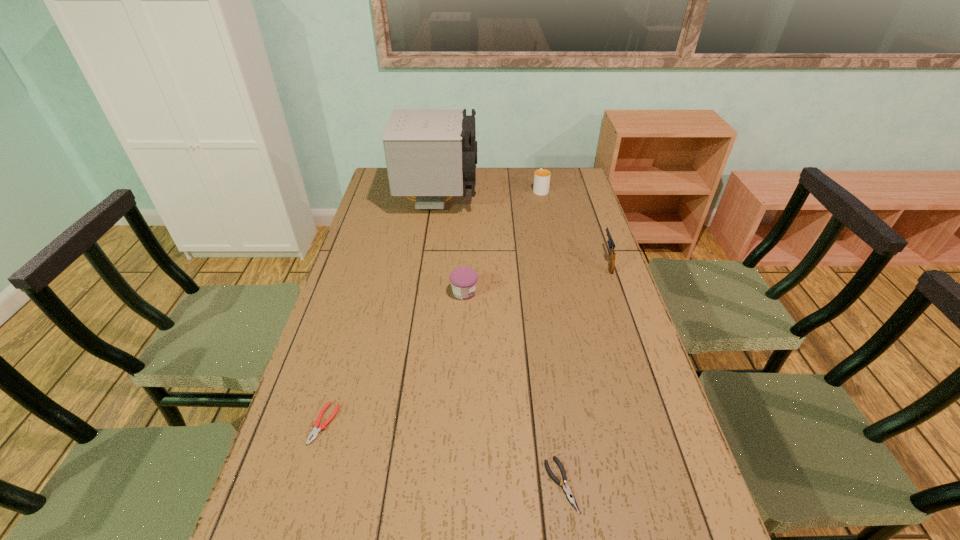
At what (x,y) coordinates should I click in order to perform the action: click on vacant area located 0.050m on the left of the tallest object. Please return your answer as a coordinate pair (x, y). Looking at the image, I should click on (386, 201).

Where is `vacant point located along the barrel of the gun`? vacant point located along the barrel of the gun is located at coordinates (598, 233).

The height and width of the screenshot is (540, 960). I want to click on vacant point located along the barrel of the gun, so click(x=585, y=194).

You are a GUI agent. You are given a task and a screenshot of the screen. Output one action in this format:
    pyautogui.click(x=<x>, y=<y>)
    Task: Click on the free space located along the barrel of the gun
    
    Given the screenshot: What is the action you would take?
    pyautogui.click(x=591, y=214)

Locate an element on the screen. free spot located 0.140m with the handle on the side of the fifth object from left to right is located at coordinates (536, 168).

This screenshot has height=540, width=960. I want to click on free space located 0.050m with the handle on the side of the fifth object from left to right, so click(538, 178).

Identify the location of vacant space located with the handle on the side of the fifth object from left to right. The image size is (960, 540). (537, 172).

You are a GUI agent. You are given a task and a screenshot of the screen. Output one action in this format:
    pyautogui.click(x=<x>, y=<y>)
    Task: Click on the free region located 0.080m on the front label of the third nearest object
    
    Given the screenshot: What is the action you would take?
    pyautogui.click(x=503, y=293)

Where is `free space located 0.310m on the back of the nearer pliers`? free space located 0.310m on the back of the nearer pliers is located at coordinates (542, 350).

Where is `vacant position located 0.200m on the right of the second nearest object`? Image resolution: width=960 pixels, height=540 pixels. vacant position located 0.200m on the right of the second nearest object is located at coordinates click(x=419, y=423).